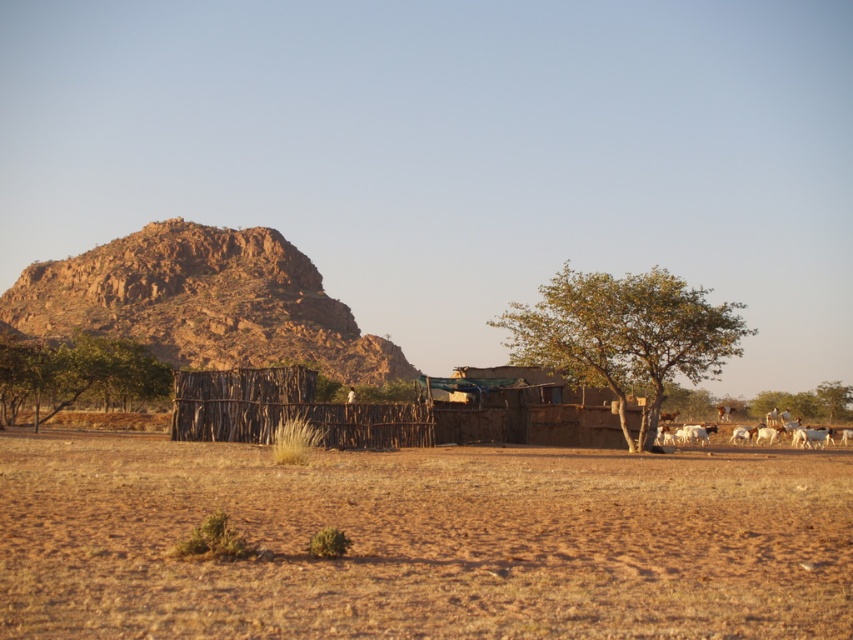
Does point (376, 506) come farther from viewer compared to point (6, 360)?

No, it is in front of (6, 360).

This screenshot has width=853, height=640. I want to click on brown dry soil at center, so click(x=422, y=541).

Identify the location of brown dry soil at center. (422, 541).

You are a GUI agent. You are given a task and a screenshot of the screen. Output one action in this format:
    pyautogui.click(x=<x>, y=<y>)
    Task: Click on the brown dry soil at center
    The width and height of the screenshot is (853, 640).
    Given the screenshot: What is the action you would take?
    pyautogui.click(x=422, y=541)

Based on the photo, is brown dry soil at center thinner than green leafy tree at center?

In fact, brown dry soil at center might be wider than green leafy tree at center.

Is point (109, 636) positioned after point (729, 342)?

No, (109, 636) is in front of (729, 342).

Which is behind, point (503, 557) or point (595, 380)?

Point (595, 380)

Find the location of `brown dry soil at center`. brown dry soil at center is located at coordinates [x=422, y=541].

Who is taller, green leafy tree at center or green leafy tree at left?

Standing taller between the two is green leafy tree at center.

What do you see at coordinates (624, 336) in the screenshot? The image size is (853, 640). I see `green leafy tree at center` at bounding box center [624, 336].

Locate an element on the screen. The width and height of the screenshot is (853, 640). green leafy tree at center is located at coordinates (624, 336).